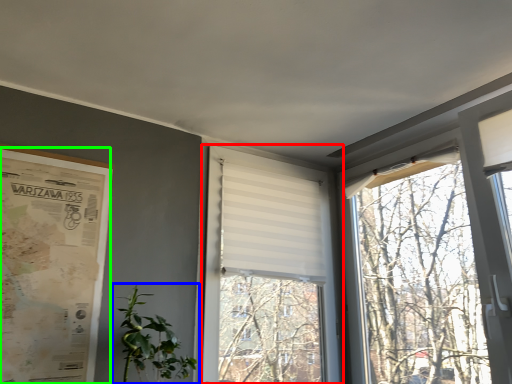
Question: Estimate the real-world distances between objects in this image. Which object is farther from window (highlighted by a red box), houseplant (highlighted by a blue box) or poster page (highlighted by a green box)?

Choices:
 (A) houseplant
 (B) poster page

Answer: (B)